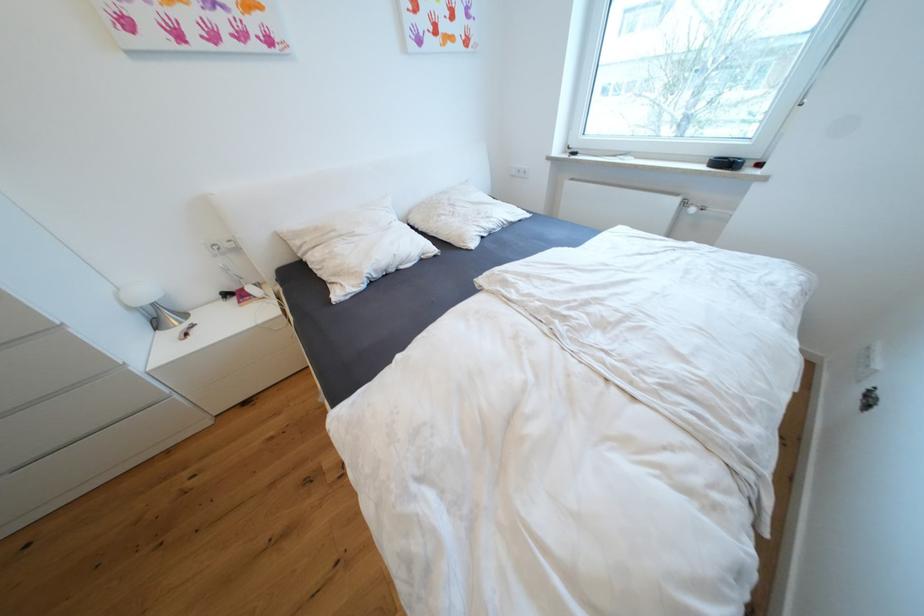
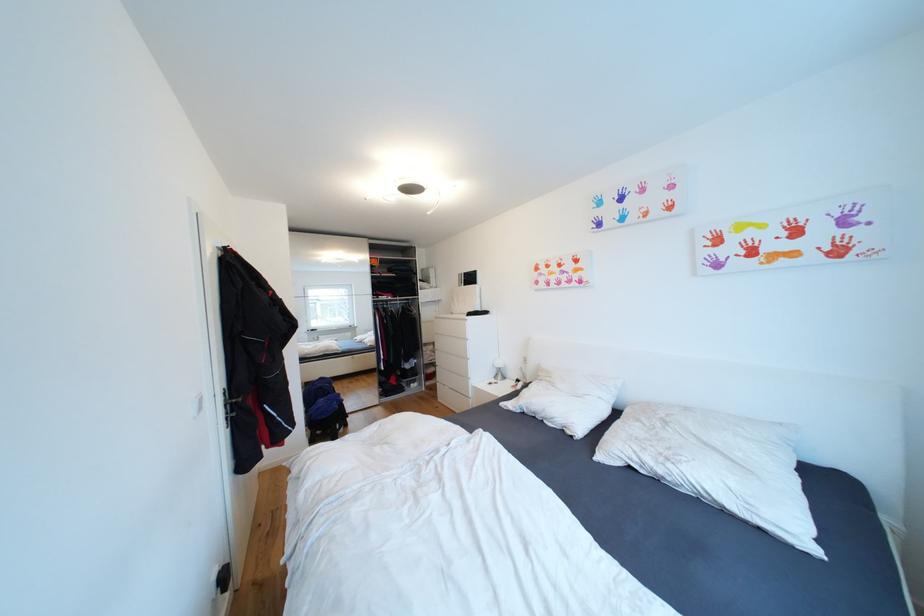
The point at (165,326) is marked in the first image. Where is the corresponding point in the second image?

(503, 378)